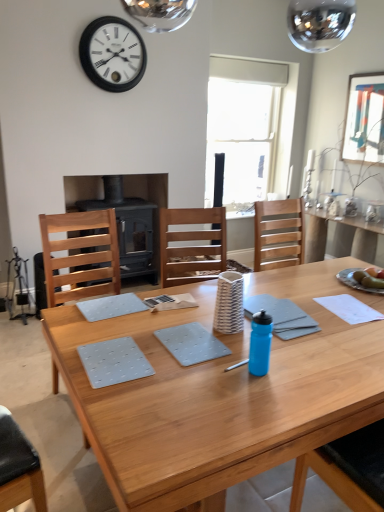
Where is `free space that is to the left of blue plastic water bottle at center`? free space that is to the left of blue plastic water bottle at center is located at coordinates (214, 373).